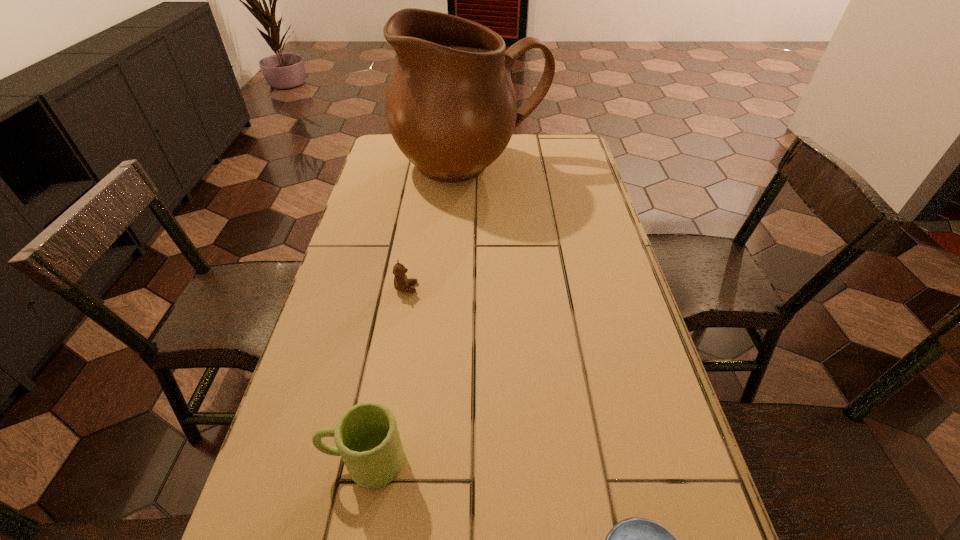
Where is `cream pitcher`? The height and width of the screenshot is (540, 960). cream pitcher is located at coordinates (451, 107).

You are a GUI agent. You are given a task and a screenshot of the screen. Output one action in this format:
    pyautogui.click(x=<x>, y=<y>)
    Task: Click on the farthest object
    
    Given the screenshot: What is the action you would take?
    pyautogui.click(x=451, y=107)

Locate an element on the screen. The image size is (960, 540). the second tallest object is located at coordinates (367, 438).

The image size is (960, 540). I want to click on mug, so click(x=367, y=438).

The height and width of the screenshot is (540, 960). I want to click on teddy bear, so (x=401, y=282).

Find the location of `the second farthest object`. the second farthest object is located at coordinates (401, 282).

Image resolution: width=960 pixels, height=540 pixels. In order to click on free location located 0.250m at the spout of the tallest object in this screenshot , I will do `click(469, 252)`.

This screenshot has width=960, height=540. Find the location of `free space located 0.090m on the side of the mug with the handle`. free space located 0.090m on the side of the mug with the handle is located at coordinates (274, 461).

The width and height of the screenshot is (960, 540). Find the location of `free space located 0.070m on the front-facing side of the second shortest object`. free space located 0.070m on the front-facing side of the second shortest object is located at coordinates (444, 288).

Find the location of a particular element. object that is at the far edge is located at coordinates (451, 107).